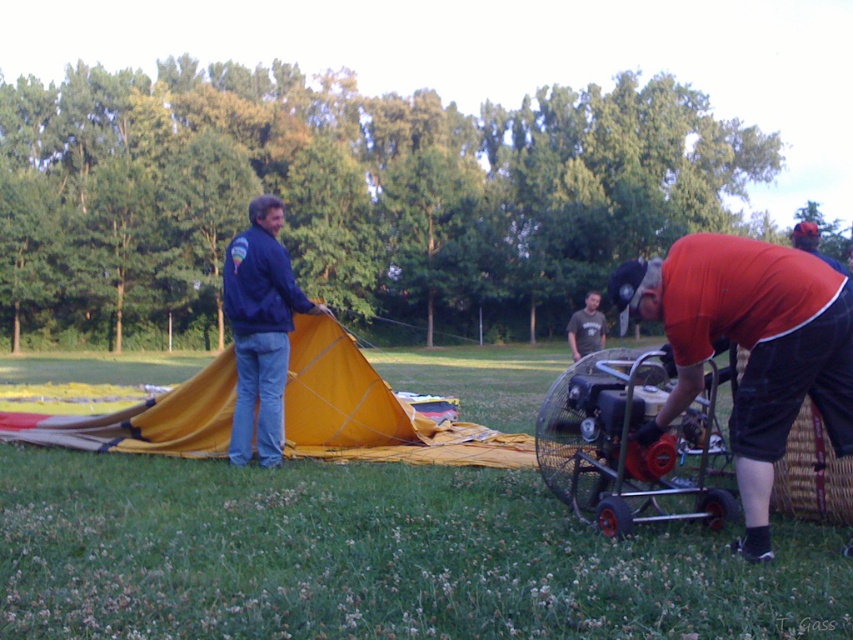
You are a photographer standing in the field and want to take a picture of the matte blue jacket at center and the yellow fabric tent at left. Which object should you adjust your camera focus to first if you want both to be in focus?

The matte blue jacket at center is behind the yellow fabric tent at left, so you should focus on the matte blue jacket at center first to ensure both are in focus.

You are standing in the grassy field and need to reach the propane tank cart operated by the man in the red shirt. There is a yellow fabric tent at left in your way. Based on its position, can you walk around it to the right side to get to the cart?

The yellow fabric tent at left is located at point (373, 412), so yes, you can walk around it to the right side to reach the propane tank cart operated by the man in the red shirt.

You are a safety inspector checking the setup for the hot air balloon launch. The safety guidelines state that the distance between the metallic red engine at center and the matte blue jacket at center must be at least 10 feet to ensure safety. Based on the scene provided, is the current distance compliant with the safety guidelines?

The metallic red engine at center and the matte blue jacket at center are 9.23 feet apart from each other, which is less than the required 10 feet. Therefore, the current distance does not comply with the safety guidelines.